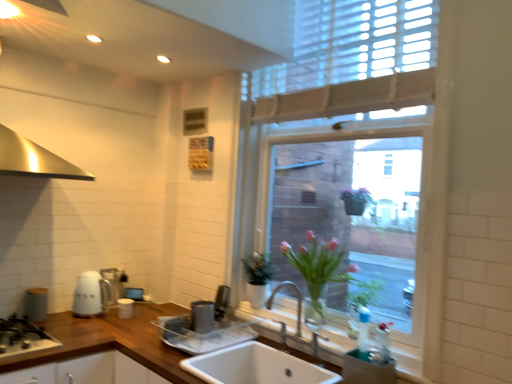
Question: Is satin silver toaster at lower center, acting as the 4th appliance starting from the back, to the right of wooden at center from the viewer's perspective?

Choices:
 (A) yes
 (B) no

Answer: (A)

Question: Can you confirm if satin silver toaster at lower center, acting as the second appliance starting from the front, is smaller than wooden at center?

Choices:
 (A) yes
 (B) no

Answer: (A)

Question: Is satin silver toaster at lower center, placed as the fourth appliance when sorted from left to right, bigger than wooden at center?

Choices:
 (A) yes
 (B) no

Answer: (B)

Question: Could wooden at center be considered to be inside satin silver toaster at lower center, placed as the fourth appliance when sorted from left to right?

Choices:
 (A) no
 (B) yes

Answer: (A)

Question: Is satin silver toaster at lower center, acting as the second appliance starting from the front, facing towards wooden at center?

Choices:
 (A) yes
 (B) no

Answer: (B)

Question: Are satin silver toaster at lower center, placed as the fourth appliance when sorted from left to right, and wooden at center making contact?

Choices:
 (A) no
 (B) yes

Answer: (A)

Question: Is transparent glass window at center at the left side of wooden at center?

Choices:
 (A) yes
 (B) no

Answer: (B)

Question: Is wooden at center surrounded by transparent glass window at center?

Choices:
 (A) no
 (B) yes

Answer: (A)

Question: Is transparent glass window at center shorter than wooden at center?

Choices:
 (A) yes
 (B) no

Answer: (B)

Question: Is transparent glass window at center in front of wooden at center?

Choices:
 (A) no
 (B) yes

Answer: (A)

Question: From a real-world perspective, is transparent glass window at center on wooden at center?

Choices:
 (A) yes
 (B) no

Answer: (A)

Question: Is transparent glass window at center aimed at wooden at center?

Choices:
 (A) no
 (B) yes

Answer: (A)

Question: Are satin silver toaster at lower center, acting as the 4th appliance starting from the back, and black matte gas stove at lower left making contact?

Choices:
 (A) no
 (B) yes

Answer: (A)